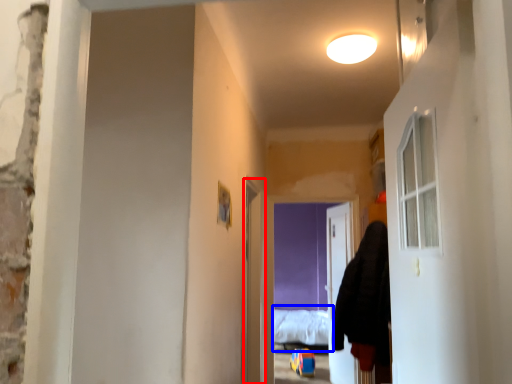
Question: Which object is closer to the camera taking this photo, screen door (highlighted by a red box) or bed (highlighted by a blue box)?

Choices:
 (A) screen door
 (B) bed

Answer: (A)